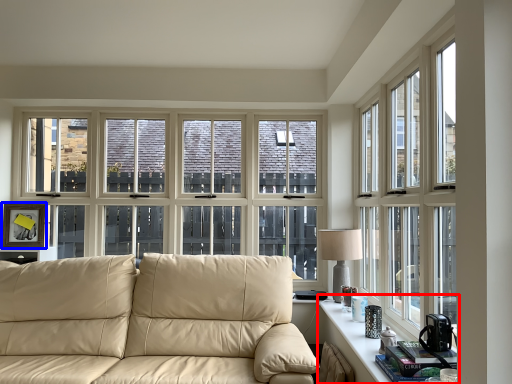
Question: Which object is further to the camera taking this photo, table (highlighted by a red box) or picture frame (highlighted by a blue box)?

Choices:
 (A) table
 (B) picture frame

Answer: (B)